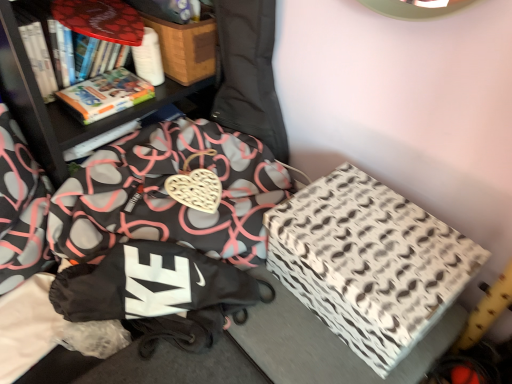
Question: From the image's perspective, relative to black fabric bag at lower left, is wooden box at upper center, the second cardboard box in the right-to-left sequence, above or below?

Choices:
 (A) below
 (B) above

Answer: (B)

Question: Looking at the image, does wooden box at upper center, which appears as the 1th cardboard box when viewed from the left, seem bigger or smaller compared to black fabric bag at lower left?

Choices:
 (A) small
 (B) big

Answer: (A)

Question: Which object is the farthest from the wooden box at upper center, which appears as the 1th cardboard box when viewed from the left?

Choices:
 (A) hardcover book at upper left
 (B) black fabric bean bag chair at center
 (C) black fabric bag at lower left
 (D) white-patterned cardboard box at right, the second cardboard box viewed from the left

Answer: (D)

Question: Considering the real-world distances, which object is farthest from the black fabric bean bag chair at center?

Choices:
 (A) white-patterned cardboard box at right, the second cardboard box viewed from the left
 (B) hardcover book at upper left
 (C) black fabric bag at lower left
 (D) wooden box at upper center, the first cardboard box when ordered from top to bottom

Answer: (C)